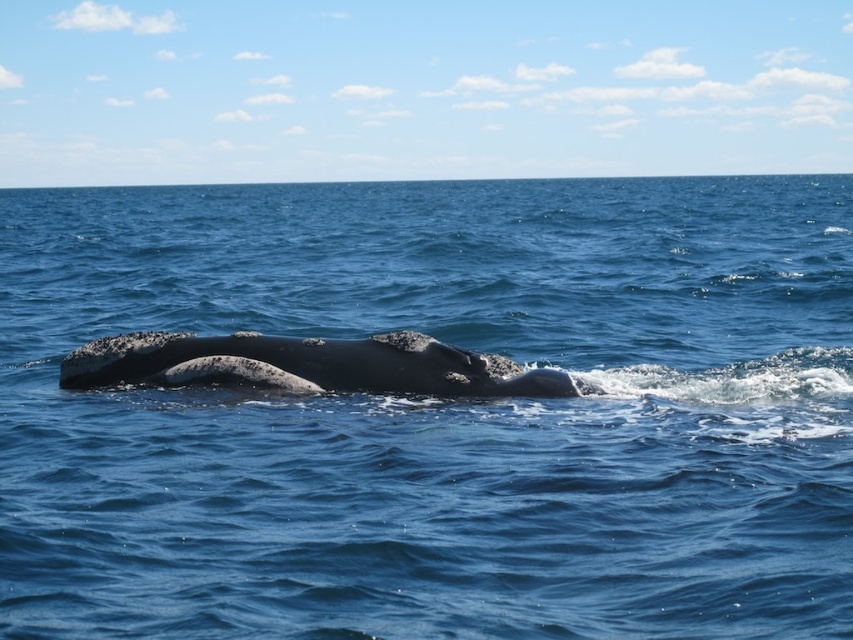
Question: Which point appears farthest from the camera in this image?

Choices:
 (A) (665, 451)
 (B) (221, 340)

Answer: (B)

Question: Does glossy blue water at center have a lesser width compared to smooth gray whale at center?

Choices:
 (A) no
 (B) yes

Answer: (A)

Question: Can you confirm if glossy blue water at center is smaller than smooth gray whale at center?

Choices:
 (A) yes
 (B) no

Answer: (B)

Question: Where is glossy blue water at center located in relation to smooth gray whale at center in the image?

Choices:
 (A) below
 (B) above

Answer: (B)

Question: Among these points, which one is nearest to the camera?

Choices:
 (A) (383, 445)
 (B) (339, 346)

Answer: (A)

Question: Which point is farther to the camera?

Choices:
 (A) (660, 384)
 (B) (345, 352)

Answer: (A)